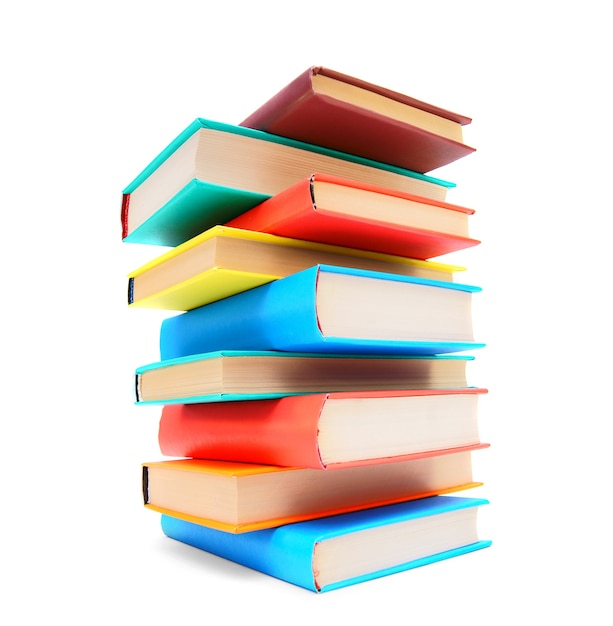
Image resolution: width=613 pixels, height=626 pixels. Find the location of `book`. book is located at coordinates (349, 111), (243, 160), (311, 198), (235, 259), (284, 322), (211, 372), (292, 444), (244, 489), (294, 563).